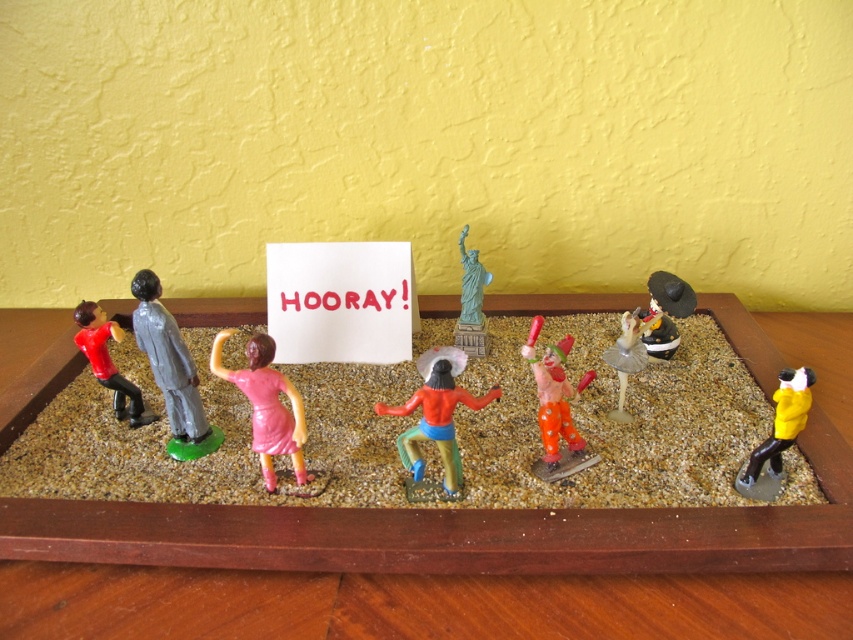
Question: Which point is closer to the camera taking this photo?

Choices:
 (A) (94, 364)
 (B) (474, 288)
 (C) (260, 348)
 (D) (314, 253)

Answer: (C)

Question: Is matte gray figure at center-left bigger than white plastic ballet dancer at center?

Choices:
 (A) no
 (B) yes

Answer: (B)

Question: Is pink glossy figurine at center above matte black clown at center?

Choices:
 (A) yes
 (B) no

Answer: (B)

Question: Can you confirm if pink glossy figurine at center is positioned to the right of matte black clown at center?

Choices:
 (A) yes
 (B) no

Answer: (B)

Question: Which point appears farthest from the camera in this image?

Choices:
 (A) (622, 419)
 (B) (682, 300)

Answer: (B)

Question: Which of the following is the closest to the observer?

Choices:
 (A) (480, 291)
 (B) (355, 308)
 (C) (642, 348)

Answer: (C)